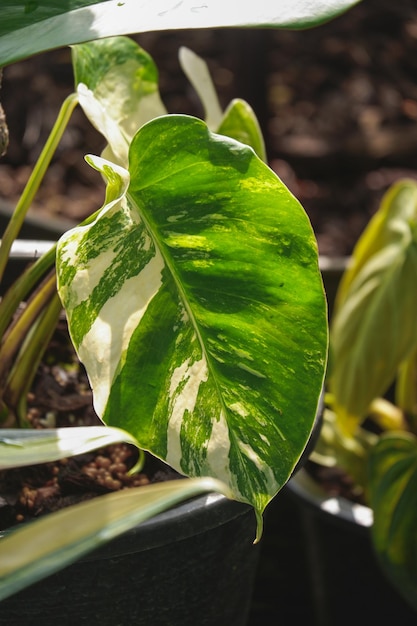
Where is `rim of vases`? This screenshot has width=417, height=626. rim of vases is located at coordinates (324, 508), (192, 521), (37, 223).